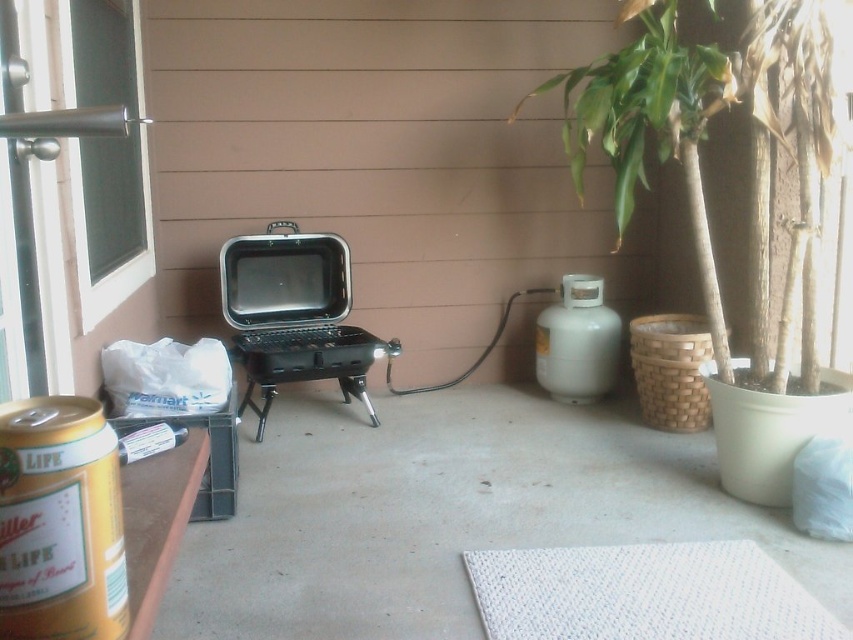
Question: Can you confirm if black matte barbecue grill at center is positioned above clear glass screen door at upper left?

Choices:
 (A) no
 (B) yes

Answer: (A)

Question: Which of the following is the farthest from the observer?

Choices:
 (A) tap(279, 257)
 (B) tap(91, 304)

Answer: (A)

Question: Is black matte barbecue grill at center to the left of clear glass screen door at upper left from the viewer's perspective?

Choices:
 (A) no
 (B) yes

Answer: (A)

Question: Which point appears closest to the camera in this image?

Choices:
 (A) (222, 288)
 (B) (80, 61)

Answer: (B)

Question: Is black matte barbecue grill at center thinner than clear glass screen door at upper left?

Choices:
 (A) yes
 (B) no

Answer: (B)